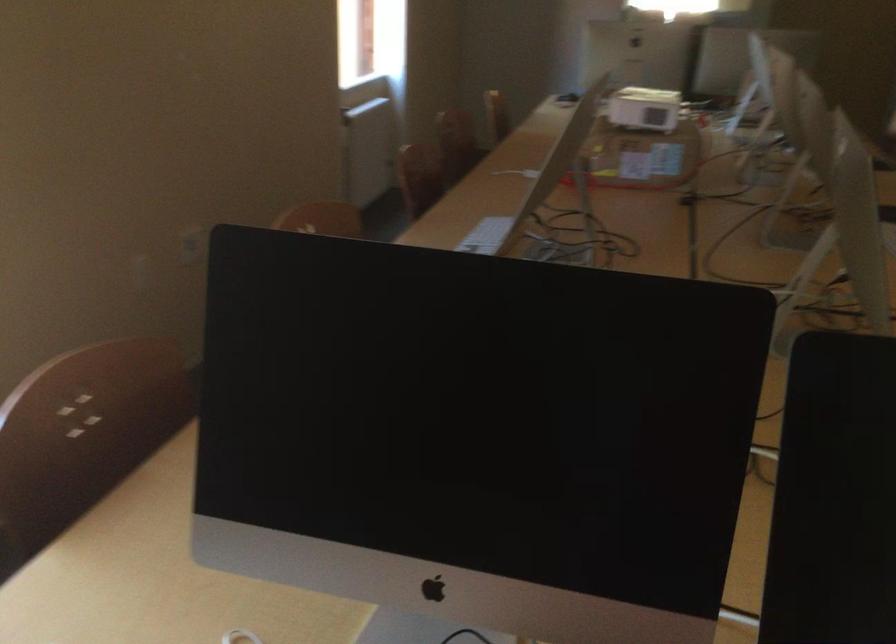
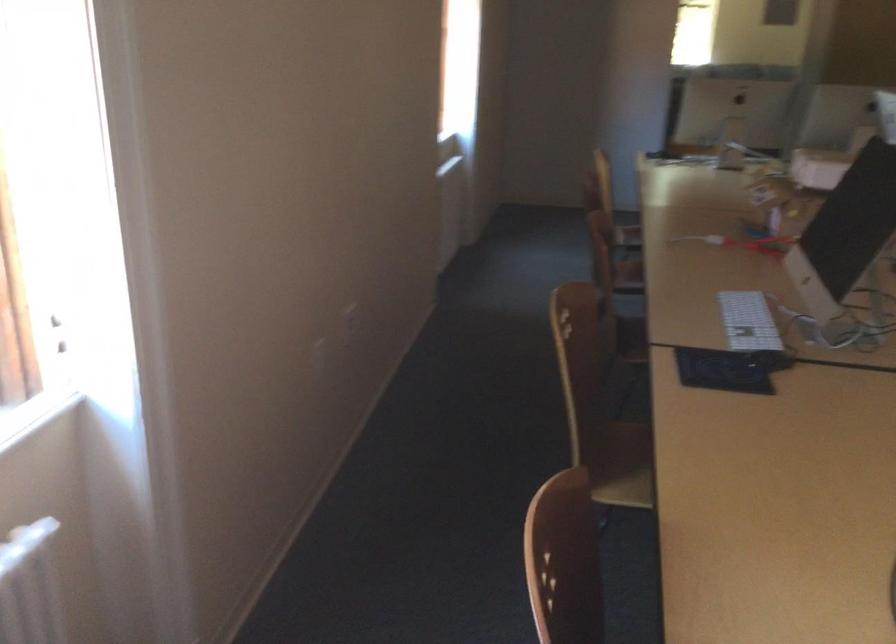
In the second image, find the point that corresponds to pixel 487 242 in the first image.

(747, 321)